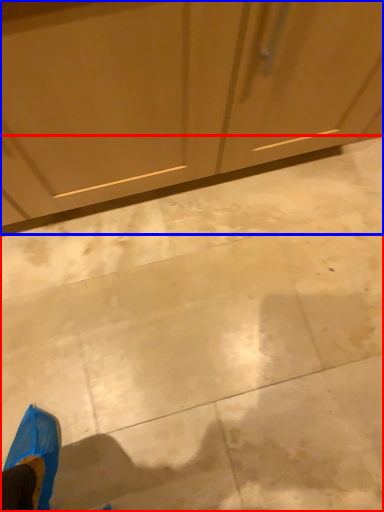
Question: Among these objects, which one is farthest to the camera, concrete (highlighted by a red box) or dresser (highlighted by a blue box)?

Choices:
 (A) concrete
 (B) dresser

Answer: (A)